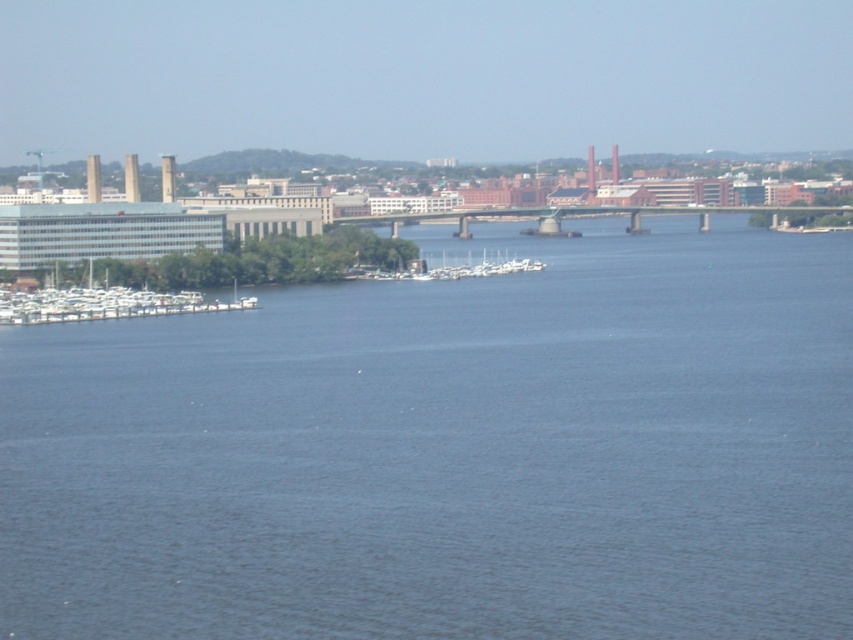
Which is behind, point (9, 454) or point (70, 298)?

Positioned behind is point (70, 298).

Is blue water at center to the right of white matte boats at left from the viewer's perspective?

Yes, blue water at center is to the right of white matte boats at left.

Image resolution: width=853 pixels, height=640 pixels. Identify the location of blue water at center. (450, 451).

Is point (339, 381) positioned behind point (373, 269)?

No.

Is blue water at center taller than white matte boats at center?

Correct, blue water at center is much taller as white matte boats at center.

Where is `blue water at center`? blue water at center is located at coordinates (450, 451).

I want to click on blue water at center, so click(450, 451).

Looking at this image, is white matte boats at left positioned in front of white matte boats at center?

No, it is behind white matte boats at center.

In the scene shown: Is white matte boats at left to the left of white matte boats at center from the viewer's perspective?

Yes, white matte boats at left is to the left of white matte boats at center.

Does point (144, 296) come in front of point (418, 259)?

That is False.

Find the location of a particular element. The height and width of the screenshot is (640, 853). white matte boats at left is located at coordinates (103, 301).